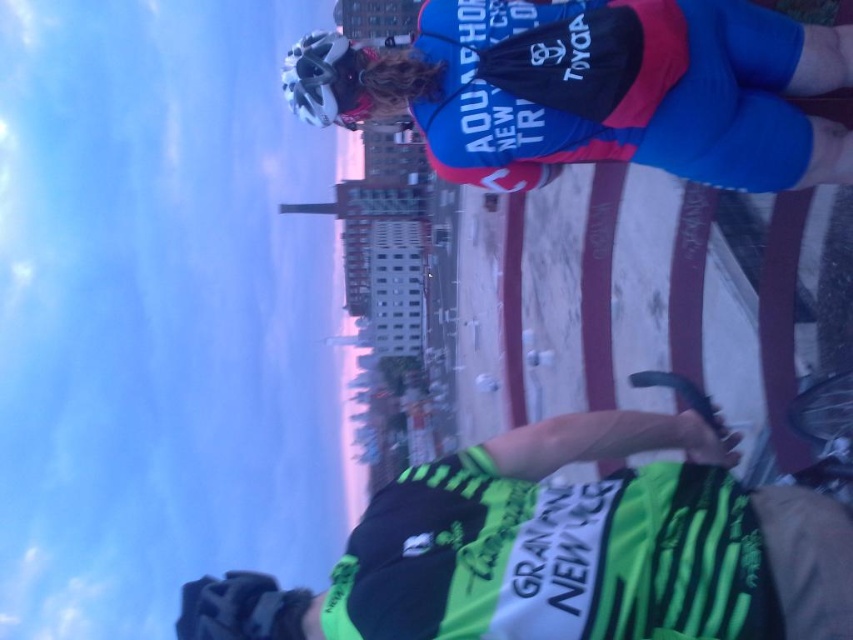
You are a photographer trying to capture a photo of the scene. You want to ensure that the green striped jersey at lower right and the white matte bicycle helmet at upper center are both visible in the frame. Based on their positions, which object is closer to the bottom edge of the photo?

The green striped jersey at lower right is closer to the bottom edge of the photo because it is positioned below the white matte bicycle helmet at upper center.

You are standing at the point labeled point (822, 141) and want to walk towards the point labeled point (519, 602). Will you pass by the person in the bright green and black cycling jersey along the way?

Yes, you will pass by the person in the bright green and black cycling jersey along the way because point (519, 602) is in front of point (822, 141), meaning the path towards point (519, 602) would go past the person.

You are a photographer trying to capture a photo of the green striped jersey at lower right and the white matte bicycle helmet at upper center. Since you want both objects to appear proportionally sized in your image, which object should you move closer to, and which should you move farther away?

To make both objects appear proportionally sized in your photo, you should move closer to the white matte bicycle helmet at upper center and move farther away from the green striped jersey at lower right because the green striped jersey at lower right is already wider than the white matte bicycle helmet at upper center.